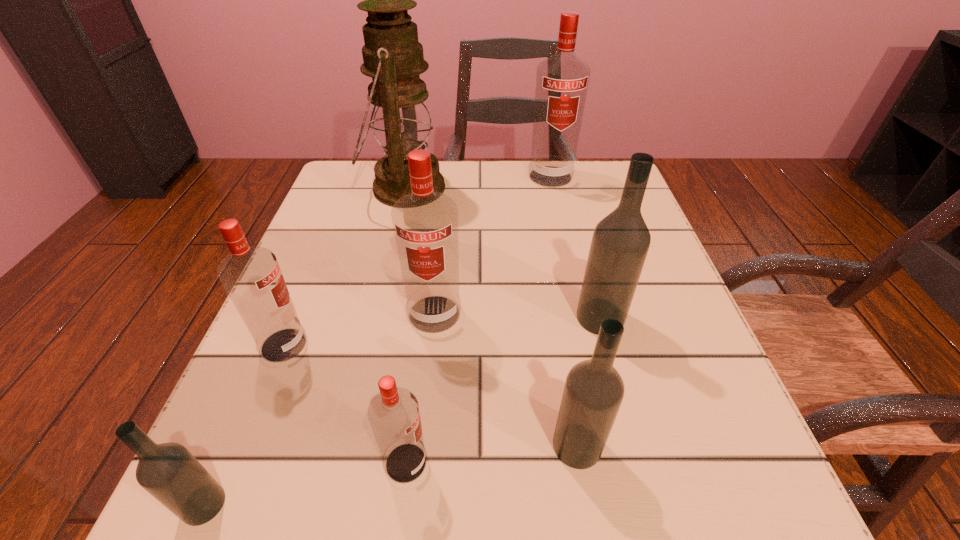
Select which vodka appears as the sixth closest to the second black vodka from right to left. Please provide its 2D coordinates. Your answer should be formatted as a tuple, i.e. [(x, y)], where the tuple contains the x and y coordinates of a point satisfying the conditions above.

[(562, 80)]

Identify which vodka is the second nearest to the rightmost black vodka. Please provide its 2D coordinates. Your answer should be formatted as a tuple, i.e. [(x, y)], where the tuple contains the x and y coordinates of a point satisfying the conditions above.

[(425, 223)]

Where is `red vodka identified as the closest to the biggest black vodka`? This screenshot has height=540, width=960. red vodka identified as the closest to the biggest black vodka is located at coordinates (425, 223).

Identify which red vodka is the third nearest to the leftmost red vodka. Please provide its 2D coordinates. Your answer should be formatted as a tuple, i.e. [(x, y)], where the tuple contains the x and y coordinates of a point satisfying the conditions above.

[(562, 80)]

Locate which black vodka is the closest to the nearest red vodka. Please provide its 2D coordinates. Your answer should be formatted as a tuple, i.e. [(x, y)], where the tuple contains the x and y coordinates of a point satisfying the conditions above.

[(593, 392)]

Identify which black vodka is the nearest to the rightmost black vodka. Please provide its 2D coordinates. Your answer should be formatted as a tuple, i.e. [(x, y)], where the tuple contains the x and y coordinates of a point satisfying the conditions above.

[(593, 392)]

You are a GUI agent. You are given a task and a screenshot of the screen. Output one action in this format:
    pyautogui.click(x=<x>, y=<y>)
    Task: Click on the free region that satisfies the following two spatial constraints: 1. on the front label of the rightmost black vodka; 2. on the right side of the farthest vodka
    This screenshot has width=960, height=540.
    Given the screenshot: What is the action you would take?
    pyautogui.click(x=583, y=318)

You are a GUI agent. You are given a task and a screenshot of the screen. Output one action in this format:
    pyautogui.click(x=<x>, y=<y>)
    Task: Click on the free location that satisfies the following two spatial constraints: 1. on the front label of the biggest red vodka; 2. on the front label of the leftmost red vodka
    
    Given the screenshot: What is the action you would take?
    pyautogui.click(x=588, y=345)

Where is `vacant space that satisfies the following two spatial constraints: 1. on the front label of the second biggest red vodka; 2. on the front label of the third biggest red vodka`? vacant space that satisfies the following two spatial constraints: 1. on the front label of the second biggest red vodka; 2. on the front label of the third biggest red vodka is located at coordinates (431, 345).

Identify the location of free space that satisfies the following two spatial constraints: 1. on the front side of the oil lamp; 2. on the right side of the farthest black vodka. The width and height of the screenshot is (960, 540). (375, 318).